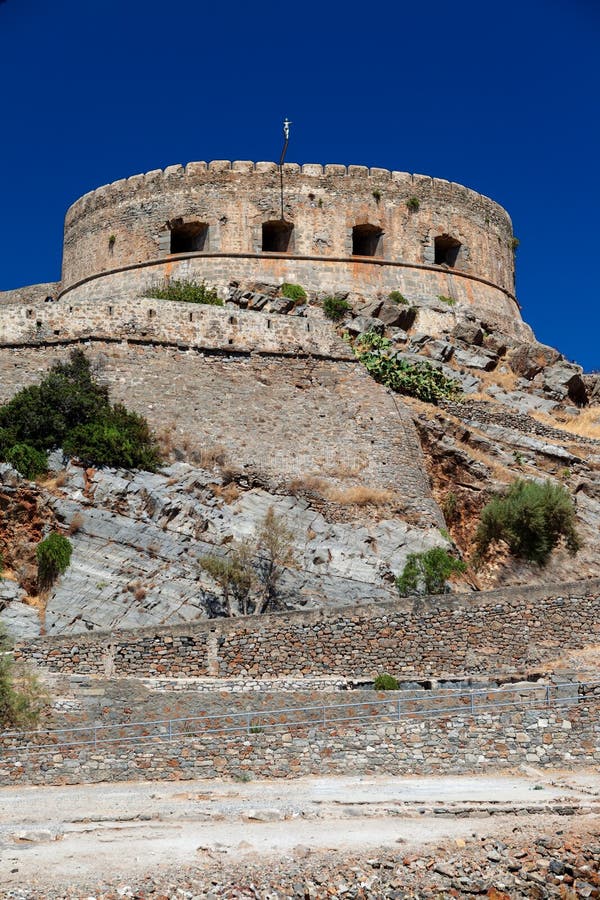
The image size is (600, 900). I want to click on statue, so click(286, 122).